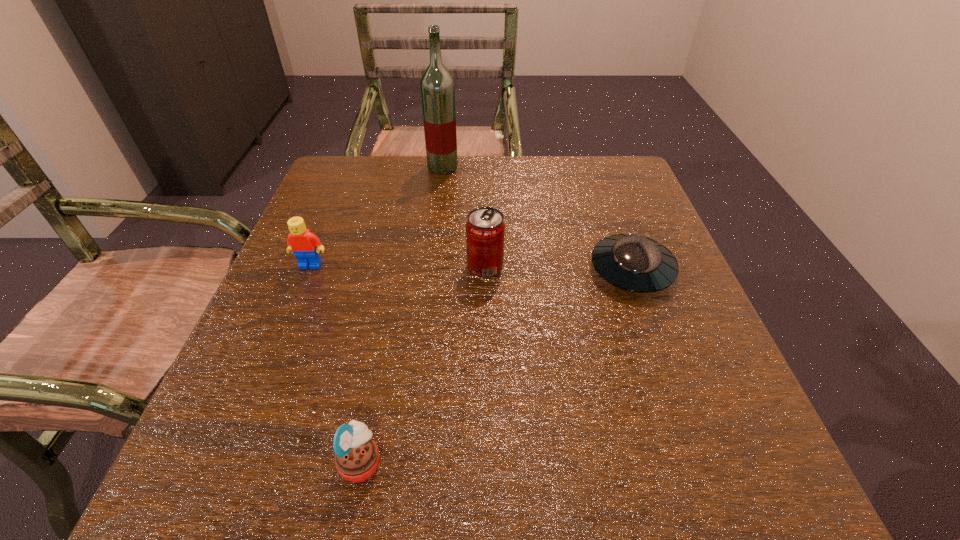
Image resolution: width=960 pixels, height=540 pixels. Find the location of `free spot located on the face of the Lego`. free spot located on the face of the Lego is located at coordinates pyautogui.click(x=294, y=307).

Locate an element on the screen. free spot located on the front-facing side of the muffin is located at coordinates [x=608, y=462].

Where is `vacant space positioned on the back of the rightmost object`? This screenshot has width=960, height=540. vacant space positioned on the back of the rightmost object is located at coordinates coord(612,218).

I want to click on object that is at the far edge, so click(x=437, y=86).

Locate an element on the screen. object present at the near edge is located at coordinates (356, 456).

Where is `object present at the left edge`? The height and width of the screenshot is (540, 960). object present at the left edge is located at coordinates (305, 245).

I want to click on object at the right edge, so click(x=635, y=263).

I want to click on vacant region at the far edge of the desktop, so click(x=462, y=179).

Locate an element on the screen. The image size is (960, 540). vacant space at the near edge of the desktop is located at coordinates (448, 476).

The width and height of the screenshot is (960, 540). Identify the location of free space at the left edge of the desktop. (362, 210).